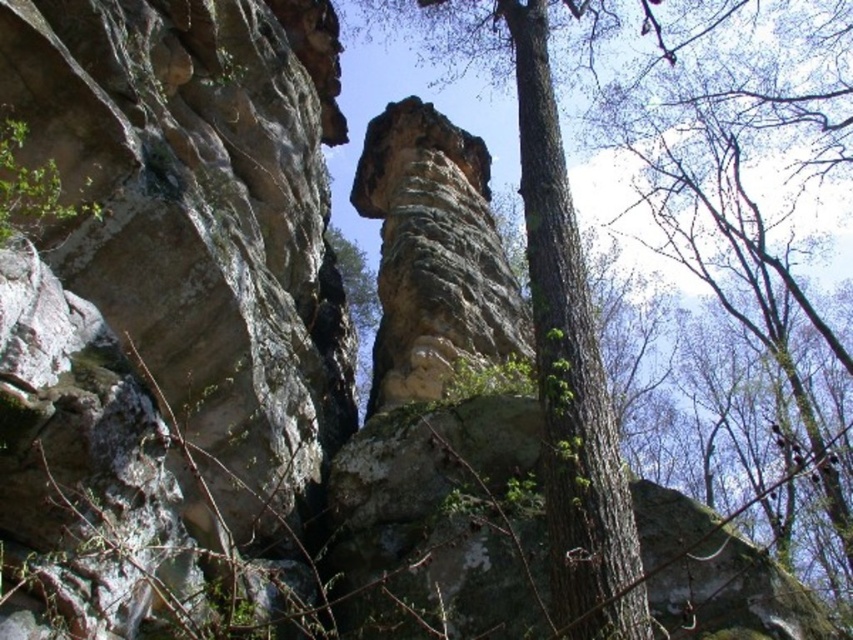
Question: Is green mossy bark tree at center wider than rusty stone column at center?

Choices:
 (A) yes
 (B) no

Answer: (A)

Question: Which object is closer to the camera taking this photo?

Choices:
 (A) green mossy bark tree at center
 (B) rusty stone column at center

Answer: (A)

Question: Which object is farther from the camera taking this photo?

Choices:
 (A) rusty stone column at center
 (B) green mossy bark tree at center

Answer: (A)

Question: From the image, what is the correct spatial relationship of green mossy bark tree at center in relation to rusty stone column at center?

Choices:
 (A) left
 (B) right

Answer: (B)

Question: Is green mossy bark tree at center wider than rusty stone column at center?

Choices:
 (A) yes
 (B) no

Answer: (A)

Question: Among these points, which one is farthest from the camera?

Choices:
 (A) (479, 230)
 (B) (584, 390)

Answer: (A)